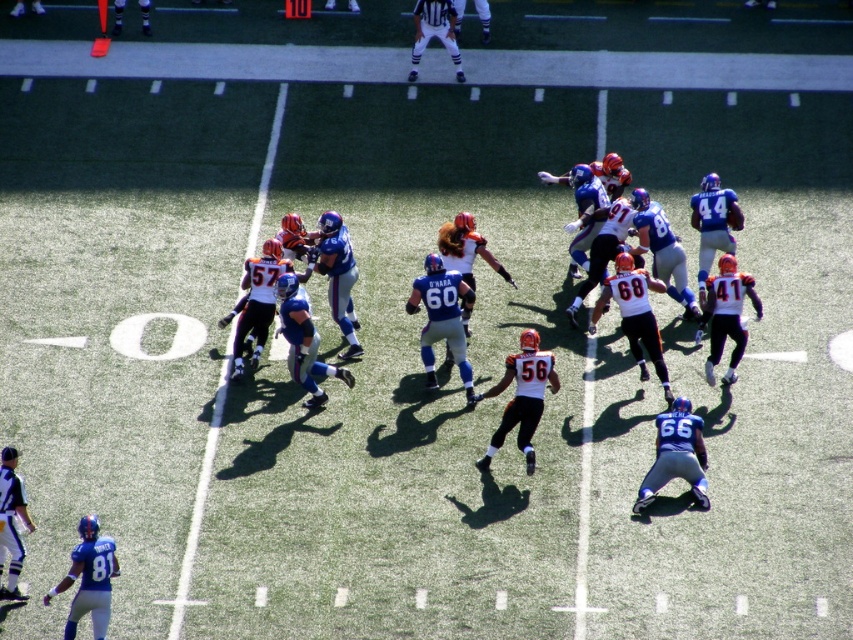
You are a referee observing the football game. You need to determine if the ball carrier is in bounds. The ball is at point (x=424, y=394). The sideline is at 0.616, 0.5. Is the ball carrier in bounds?

The ball is at point (x=424, y=394), and the sideline is at 0.616, 0.5. Since the ball is below the sideline, the ball carrier is in bounds.

You are a player on the field and want to throw a football to your teammate located at the 10 yard line. You are currently standing 14.64 meters away from the white jersey at center. How many yards is that distance in yards?

The distance between you and the white jersey at center is 14.64 meters. To convert meters to yards, multiply by 1.0936. 14.64 meters multiplied by 1.0936 equals approximately 16 yards. Therefore, you are about 16 yards away from your teammate.

You are a player on the field and you need to reach the orange jersey at center quickly. What is the minimum distance you must cover to reach it?

The minimum distance you must cover to reach the orange jersey at center is 16.50 meters.